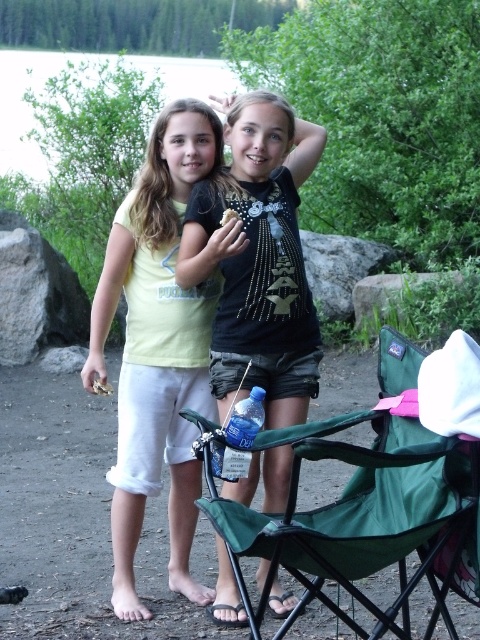
You are standing at the point labeled point (203, 195) and want to walk to the point labeled point (163, 440). Which direction should you face to move towards your destination?

To move from point (203, 195) to point (163, 440), you should face towards the right direction since point (163, 440) is behind point (203, 195).

You are a photographer trying to capture a photo of both the green fabric chair at lower center and the black matte shirt at center. Since you want them both in the frame, can you position yourself so that both are visible without moving either object?

The green fabric chair at lower center is to the right of the black matte shirt at center, so positioning yourself between them or slightly to the left of the black matte shirt at center should allow both to be visible in the frame.